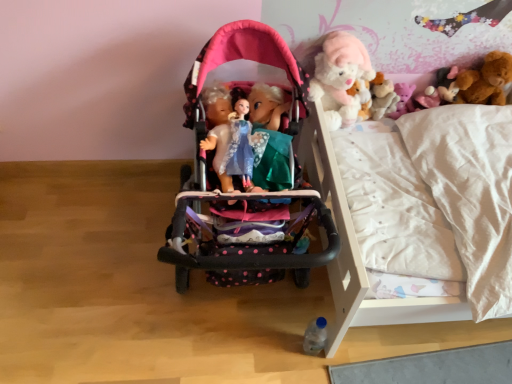
At what (x,y) coordinates should I click in order to perform the action: click on vacant space to the left of white wooden bunk bed at center. Please return your answer as a coordinate pair (x, y). Looking at the image, I should click on (100, 269).